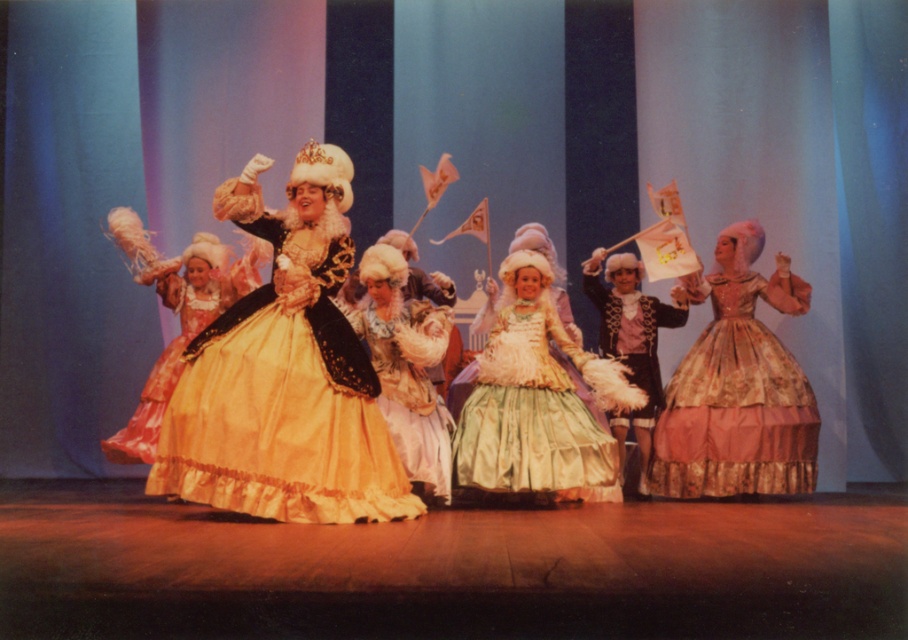
Between matte gold dress at center and floral satin dress at right, which one is positioned higher?

matte gold dress at center is higher up.

Which is behind, point (260, 234) or point (726, 355)?

The point (726, 355) is behind.

Find the location of `matte gold dress at center`. matte gold dress at center is located at coordinates (285, 372).

Is silk gold gown at center bigger than shiny gold fabric dress at center?

Correct, silk gold gown at center is larger in size than shiny gold fabric dress at center.

Does silk gold gown at center have a smaller size compared to shiny gold fabric dress at center?

Actually, silk gold gown at center might be larger than shiny gold fabric dress at center.

Is point (153, 456) closer to viewer compared to point (184, 320)?

Yes, it is.

At what (x,y) coordinates should I click in order to perform the action: click on silk gold gown at center. Please return your answer as a coordinate pair (x, y). Looking at the image, I should click on (280, 374).

Looking at this image, does shiny gold fabric dress at center have a lesser width compared to velvet black jacket at center?

Yes, shiny gold fabric dress at center is thinner than velvet black jacket at center.

Does point (143, 445) come farther from viewer compared to point (664, 323)?

No.

This screenshot has width=908, height=640. What do you see at coordinates (168, 364) in the screenshot? I see `shiny gold fabric dress at center` at bounding box center [168, 364].

You are a GUI agent. You are given a task and a screenshot of the screen. Output one action in this format:
    pyautogui.click(x=<x>, y=<y>)
    Task: Click on the shiny gold fabric dress at center
    
    Given the screenshot: What is the action you would take?
    pyautogui.click(x=168, y=364)